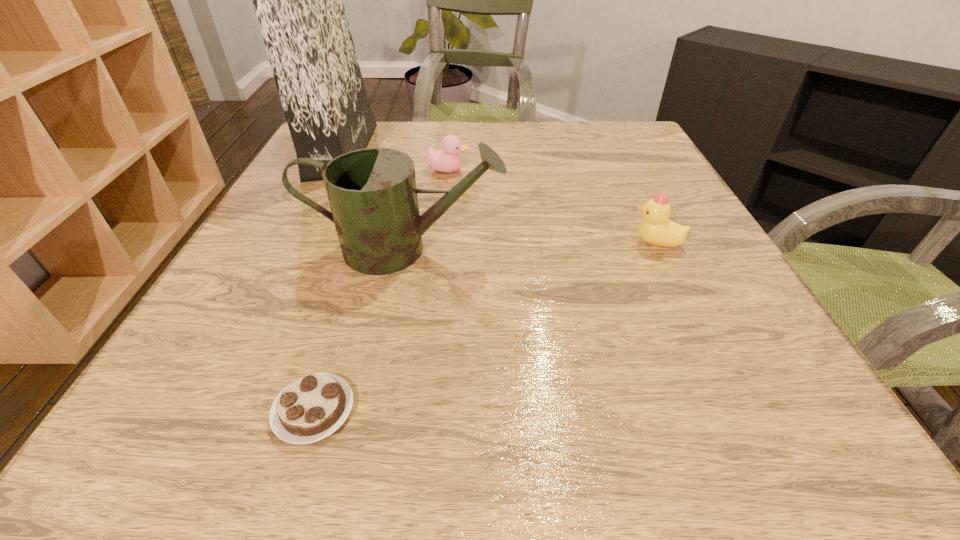
This screenshot has height=540, width=960. What are the coordinates of `object that is at the far left corner` in the screenshot? It's located at pyautogui.click(x=298, y=0).

Where is `vacant space at the far edge of the desktop`? vacant space at the far edge of the desktop is located at coordinates (567, 164).

Locate an element on the screen. This screenshot has width=960, height=540. vacant region at the near edge of the desktop is located at coordinates (487, 424).

Find the location of `vacant space at the left edge of the desktop`. vacant space at the left edge of the desktop is located at coordinates (230, 376).

The width and height of the screenshot is (960, 540). Find the location of `free space at the right edge of the desktop`. free space at the right edge of the desktop is located at coordinates pyautogui.click(x=689, y=273).

Locate an element on the screen. The height and width of the screenshot is (540, 960). vacant point at the far right corner is located at coordinates (616, 134).

The image size is (960, 540). Identify the location of vacant area between the shopping bag and the chocolate cake. (327, 280).

The height and width of the screenshot is (540, 960). What are the coordinates of `free area in between the nearer duckling and the tallest object` in the screenshot? It's located at (499, 197).

Find the location of a particular element. The height and width of the screenshot is (540, 960). vacant space that's between the left duckling and the chocolate cake is located at coordinates (381, 290).

Find the location of a particular element. The width and height of the screenshot is (960, 540). vacant point located between the left duckling and the second tallest object is located at coordinates (426, 210).